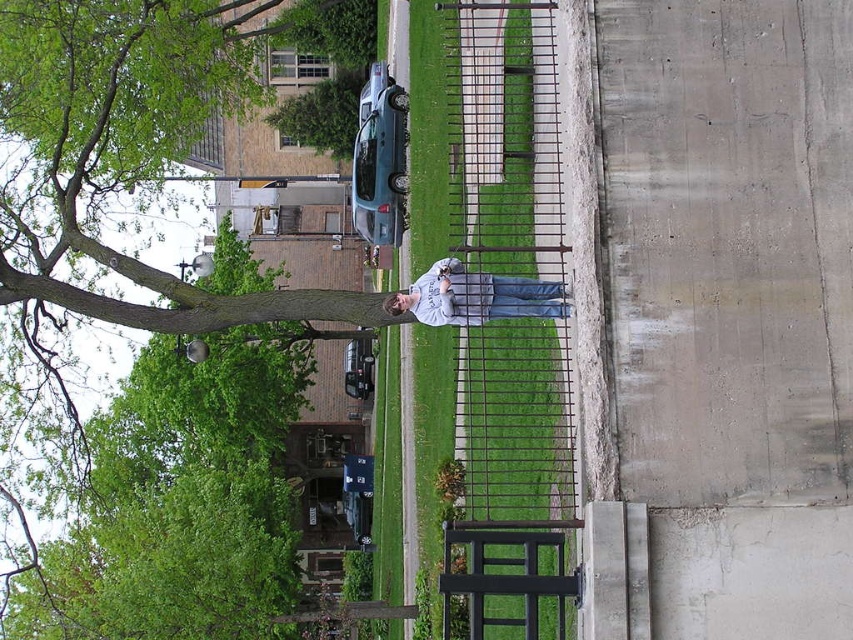
You are a photographer trying to capture a landscape shot. You are standing at the camera position and want to include the point at coordinates point (163,65) in your photo. Given that your camera has a maximum focus range of 35 meters, will you be able to focus on that point?

The distance between point (163,65) and the camera is 37.30 meters, which exceeds the camera maximum focus range of 35 meters. Therefore, you will not be able to focus on that point.

You are a photographer trying to capture a full view of the teal matte car at center without any obstructions. Given that the green rough bark tree at upper left is taller than the car, what part of the tree might be blocking the view of the car?

The green rough bark tree at upper left is taller than the teal matte car at center, so its branches or upper part might be blocking the view of the car.

You are a photographer trying to capture a candid shot of the person in the scene. Since both the green grass at center and the light gray sweatshirt at center are in the frame, which object is nearer to you?

The green grass at center is closer to the viewer than the light gray sweatshirt at center, so the green grass at center is nearer.